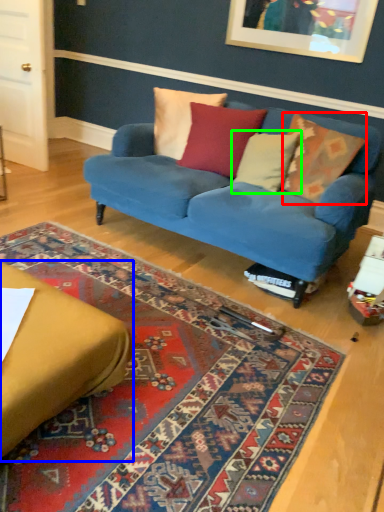
Question: Which object is the closest to the pillow (highlighted by a red box)? Choose among these: studio couch (highlighted by a blue box) or pillow (highlighted by a green box).

Choices:
 (A) studio couch
 (B) pillow

Answer: (B)